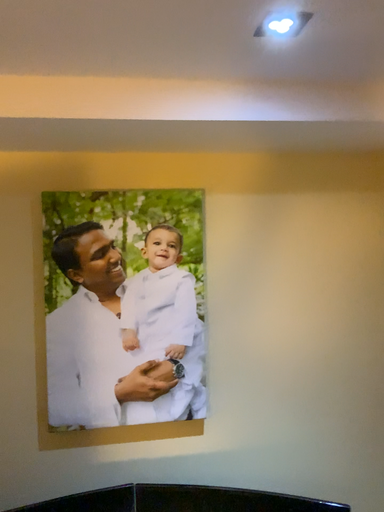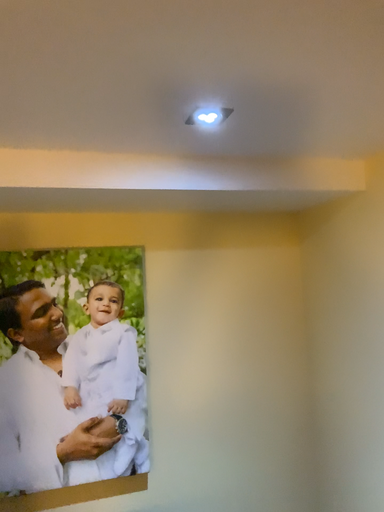
Question: Which way did the camera rotate in the video?

Choices:
 (A) rotated left
 (B) rotated right

Answer: (B)